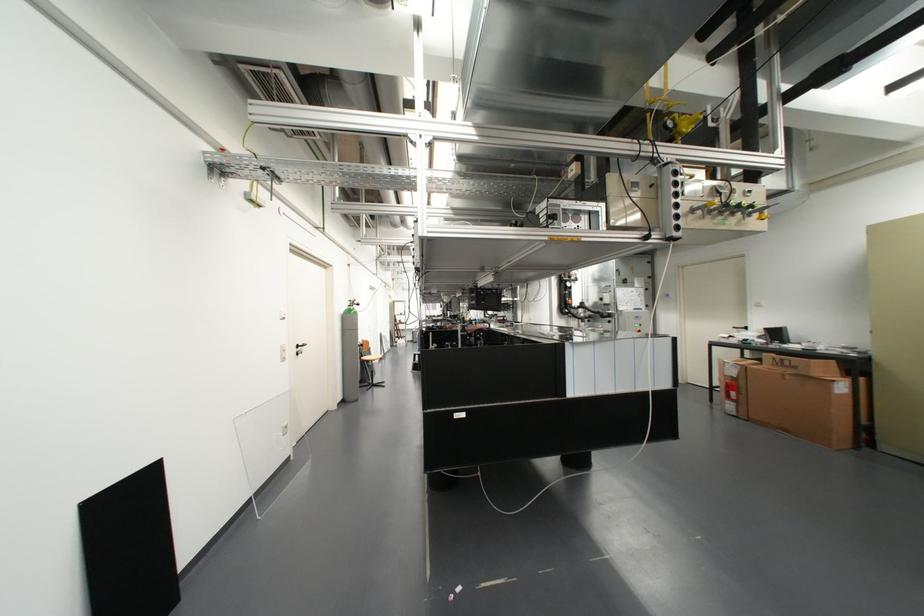
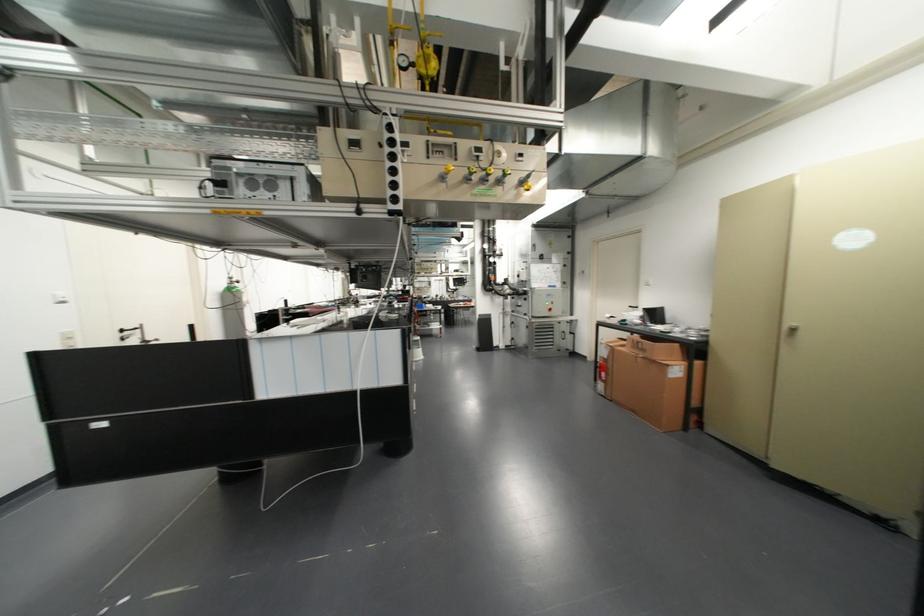
In the second image, find the point that corresponds to point 675,205 in the first image.

(393, 171)